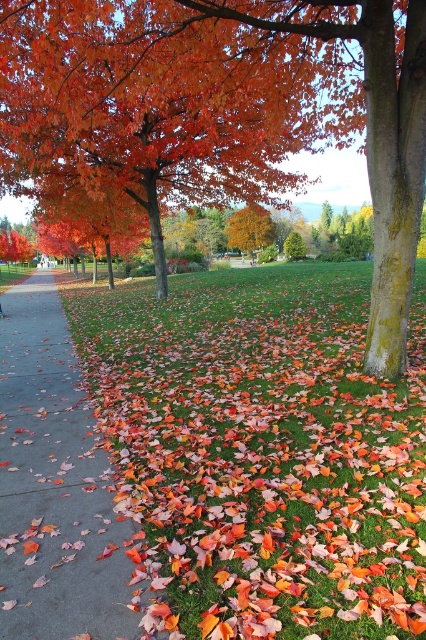
Where is `gray concrete sidewalk at lower left`? gray concrete sidewalk at lower left is located at coordinates (54, 484).